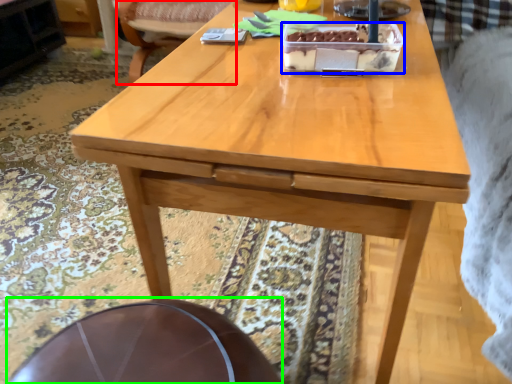
Question: Which object is positioned farthest from chair (highlighted by a red box)? Select from cake (highlighted by a blue box) and round table (highlighted by a green box).

Choices:
 (A) cake
 (B) round table

Answer: (B)